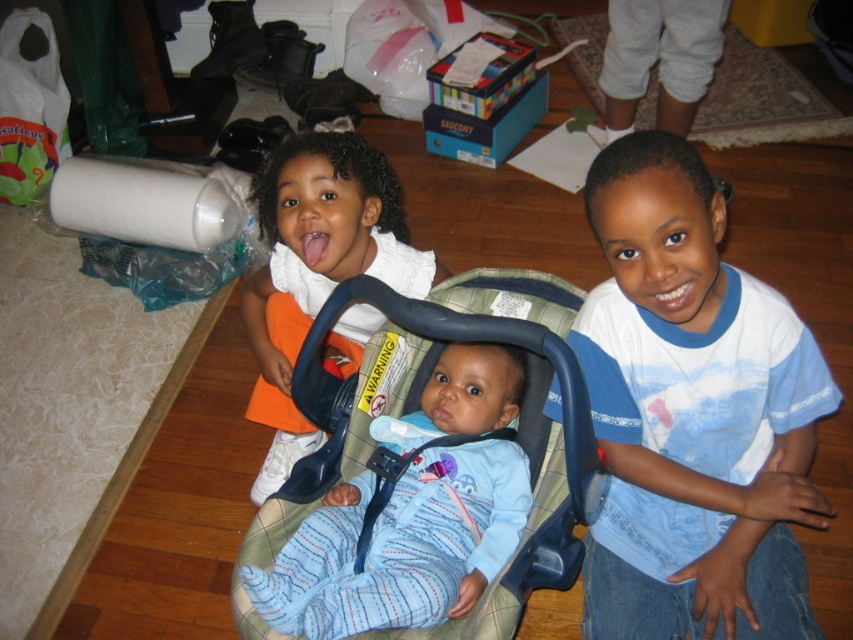
You are a photographer trying to capture a photo of the baby in the plaid fabric baby carriage at center without the blue cotton shirt at right blocking the view. Is there a way to adjust your position to achieve this?

The blue cotton shirt at right is in front of the plaid fabric baby carriage at center, so moving to the left side would allow you to see the baby carriage without obstruction from the shirt.

You are a photographer trying to capture a photo of the children. You notice the blue cotton shirt at right and the plaid fabric baby carriage at center. Which object is narrower in width?

The blue cotton shirt at right is narrower in width than the plaid fabric baby carriage at center because it is described as thinner.

You are a delivery robot with a package that needs to be delivered to the car seat. You are currently at the point marked as point (648, 196). The car seat is located at the middle child. Can you reach the car seat without moving more than 1 meter?

The distance between point (648, 196) and the car seat is 1.03 meters, so the robot cannot reach the car seat without moving more than 1 meter.